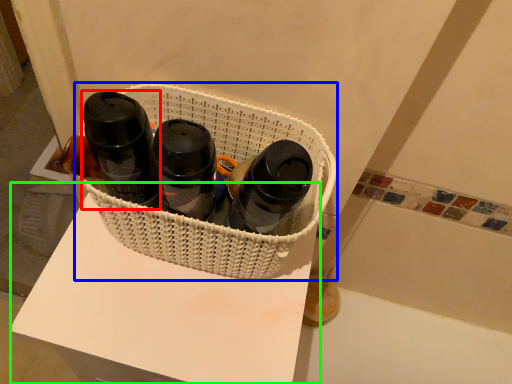
Question: Considering the real-world distances, which object is farthest from bottle (highlighted by a red box)? basket (highlighted by a blue box) or table (highlighted by a green box)?

Choices:
 (A) basket
 (B) table

Answer: (B)